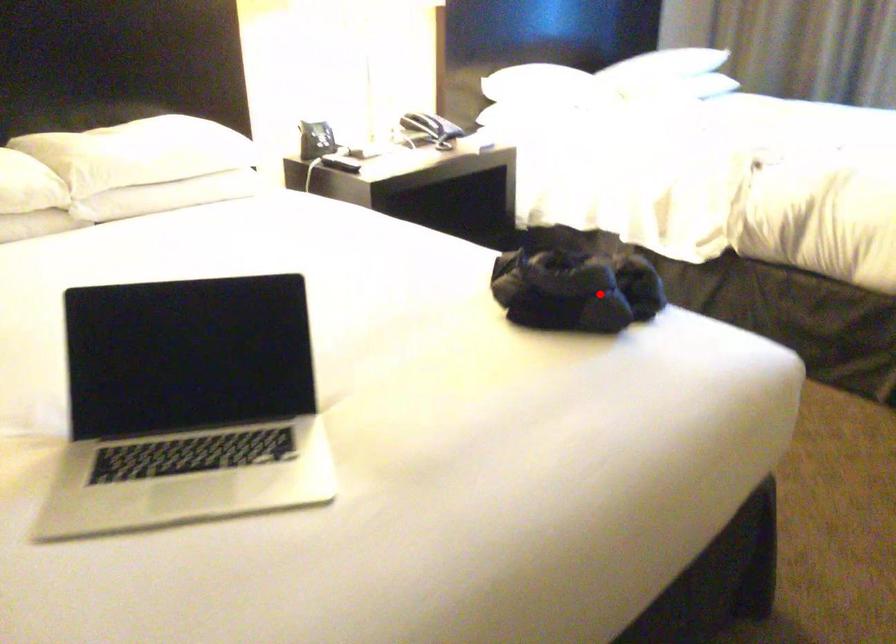
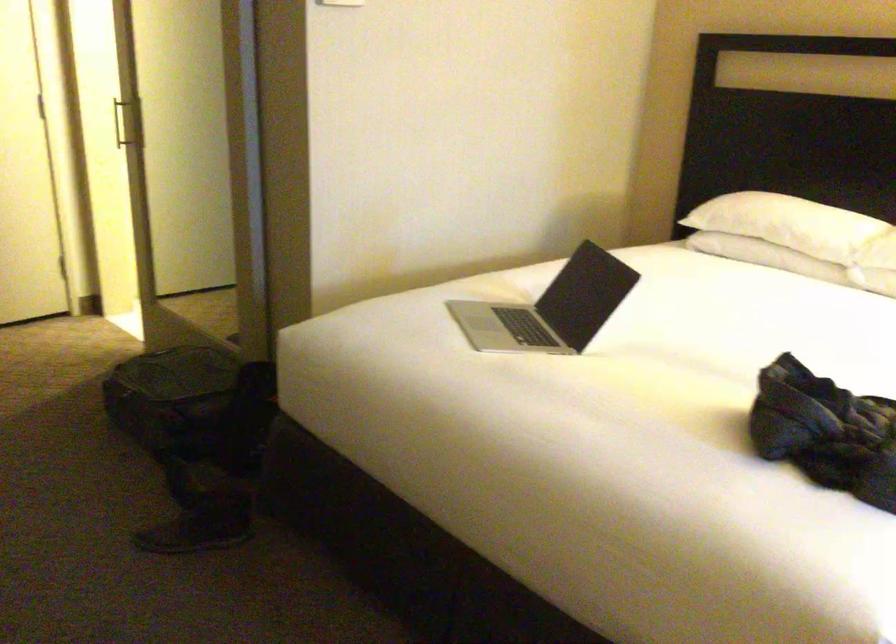
Find the pixel in the second image that matches the highlighted location in the first image.

(825, 431)